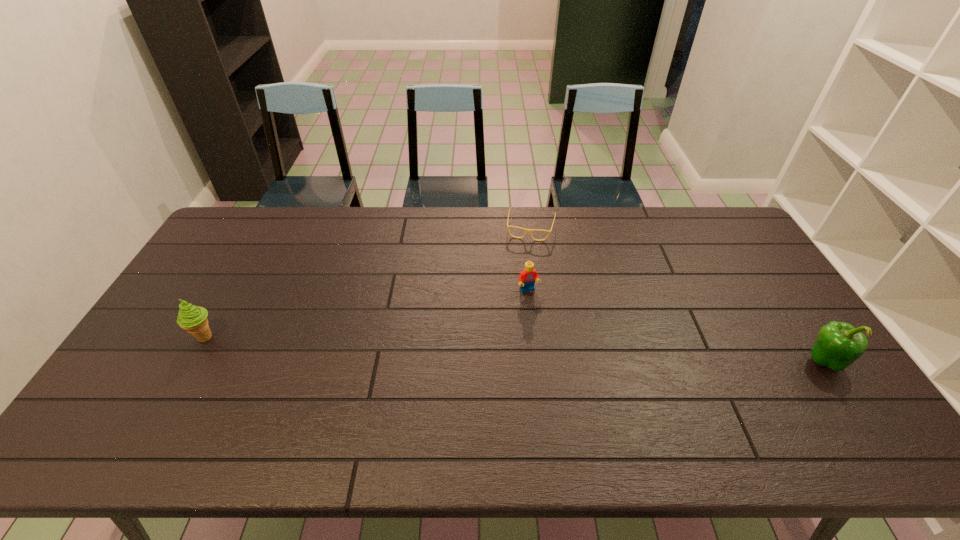
Image resolution: width=960 pixels, height=540 pixels. Identify the location of vacant region located 0.400m on the face of the Lego. (588, 409).

Locate an element on the screen. vacant space located 0.060m in front of the lenses of the spectacles is located at coordinates (525, 252).

Where is `vacant space located in front of the lenses of the spectacles`? vacant space located in front of the lenses of the spectacles is located at coordinates (514, 310).

You are a GUI agent. You are given a task and a screenshot of the screen. Output one action in this format:
    pyautogui.click(x=<x>, y=<y>)
    Task: Click on the blank space located in front of the lenses of the spectacles
    The width and height of the screenshot is (960, 540).
    Given the screenshot: What is the action you would take?
    pyautogui.click(x=523, y=262)

At what (x,y) coordinates should I click in order to perform the action: click on object located at the far edge. Please return your answer as a coordinate pair (x, y). This screenshot has width=960, height=540. Looking at the image, I should click on (526, 230).

Where is `object that is at the left edge`? The image size is (960, 540). object that is at the left edge is located at coordinates 193,319.

Where is `object present at the right edge`? Image resolution: width=960 pixels, height=540 pixels. object present at the right edge is located at coordinates (838, 345).

This screenshot has width=960, height=540. Identify the location of vacant space at the far edge of the desktop. (443, 231).

This screenshot has height=540, width=960. I want to click on vacant space at the near edge of the desktop, so click(739, 386).

In the image, there is a desktop. At what (x,y) coordinates should I click in order to perform the action: click on vacant space at the right edge. Please return your answer as a coordinate pair (x, y). The width and height of the screenshot is (960, 540). Looking at the image, I should click on (764, 282).